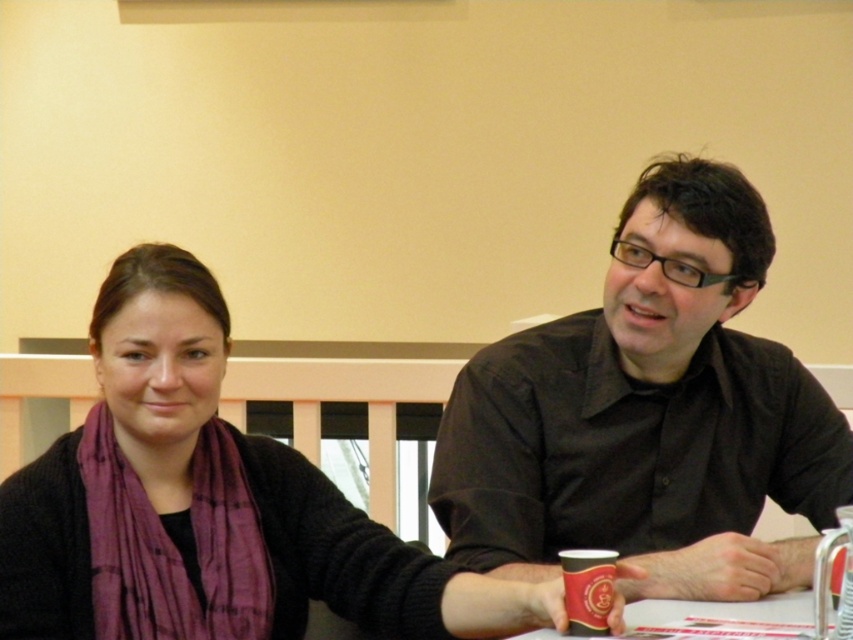
Can you confirm if matte black shirt at center is positioned above black matte cup at lower center?

Yes, matte black shirt at center is above black matte cup at lower center.

Between matte black shirt at center and black matte cup at lower center, which one appears on the left side from the viewer's perspective?

Positioned to the left is black matte cup at lower center.

Between point (779, 472) and point (595, 577), which one is positioned in front?

Positioned in front is point (595, 577).

This screenshot has height=640, width=853. Find the location of `matte black shirt at center`. matte black shirt at center is located at coordinates (648, 413).

Which is more to the left, purple scarf at center or black matte cup at lower center?

From the viewer's perspective, purple scarf at center appears more on the left side.

Can you confirm if purple scarf at center is bigger than black matte cup at lower center?

Correct, purple scarf at center is larger in size than black matte cup at lower center.

Is point (320, 500) positioned in front of point (579, 612)?

No, (320, 500) is further to viewer.

Find the location of a particular element. This screenshot has width=853, height=640. purple scarf at center is located at coordinates (207, 506).

Is point (706, 278) positioned before point (25, 568)?

That is False.

Does matte black shirt at center have a greater height compared to purple scarf at center?

Yes, matte black shirt at center is taller than purple scarf at center.

Which is in front, point (578, 403) or point (381, 632)?

Point (381, 632) is in front.

At what (x,y) coordinates should I click in order to perform the action: click on matte black shirt at center. Please return your answer as a coordinate pair (x, y). This screenshot has height=640, width=853. Looking at the image, I should click on (648, 413).